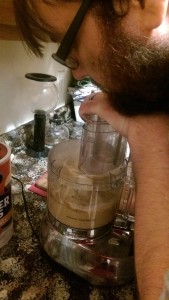
You are a GUI agent. You are given a task and a screenshot of the screen. Output one action in this format:
    pyautogui.click(x=<x>, y=<y>)
    Task: Click on the wire of applicance
    
    Given the screenshot: What is the action you would take?
    pyautogui.click(x=38, y=246), pyautogui.click(x=31, y=226), pyautogui.click(x=25, y=209), pyautogui.click(x=23, y=192), pyautogui.click(x=14, y=177)